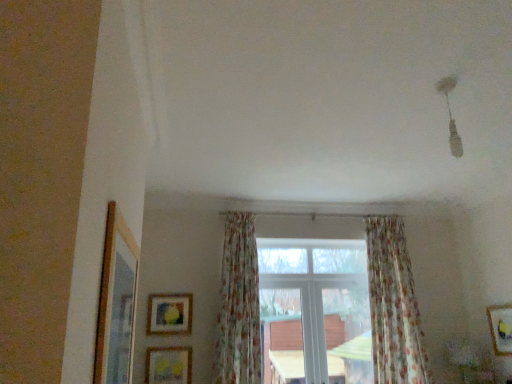
Question: Do you think floral fabric curtain at center, arranged as the 1th curtain when viewed from the left, is within floral fabric curtain at center, which is counted as the 1th curtain, starting from the right, or outside of it?

Choices:
 (A) outside
 (B) inside

Answer: (A)

Question: Considering the positions of point (247, 215) and point (369, 236), is point (247, 215) closer or farther from the camera than point (369, 236)?

Choices:
 (A) closer
 (B) farther

Answer: (A)

Question: Considering the real-world distances, which object is farthest from the white plastic window at center?

Choices:
 (A) floral fabric curtain at center, which is counted as the 1th curtain, starting from the right
 (B) wooden picture frame at left, which is counted as the fourth picture frame, starting from the bottom
 (C) wooden framed picture at lower right, which ranks as the 2th picture frame in front-to-back order
 (D) wooden matte picture frame at lower left, the first picture frame viewed from the left
 (E) floral fabric curtain at center, the second curtain when ordered from right to left

Answer: (B)

Question: Considering the real-world distances, which object is closest to the wooden matte picture frame at lower left, the fourth picture frame from the right?

Choices:
 (A) white plastic window at center
 (B) wooden picture frame at left, which is counted as the fourth picture frame, starting from the bottom
 (C) matte yellow picture frame at lower center, the third picture frame in the front-to-back sequence
 (D) floral fabric curtain at center, marked as the 2th curtain in a left-to-right arrangement
 (E) floral fabric curtain at center, arranged as the 1th curtain when viewed from the left

Answer: (C)